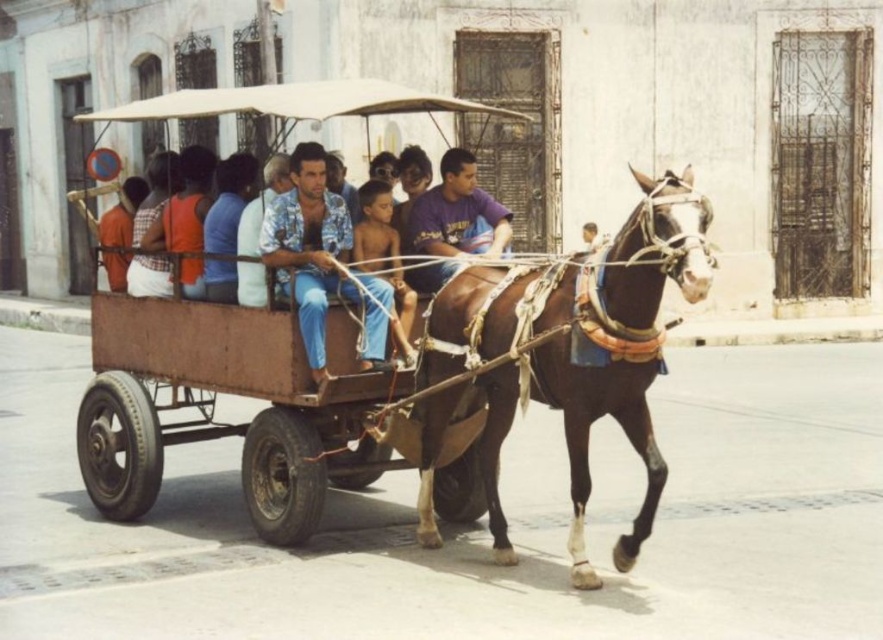
You are standing in front of the horse and cart scene. There are two points marked on the image. The first point is at coordinate point (274, 412) and the second is at point (293, 300). Which point is closer to you?

Point (274, 412) is further to the camera than point (293, 300), so the point closer to you is point (293, 300).

You are standing on the street and see the brown glossy horse at center. Where exactly is the horse positioned in the image?

The brown glossy horse at center is located at point [582,348] in the image coordinates.